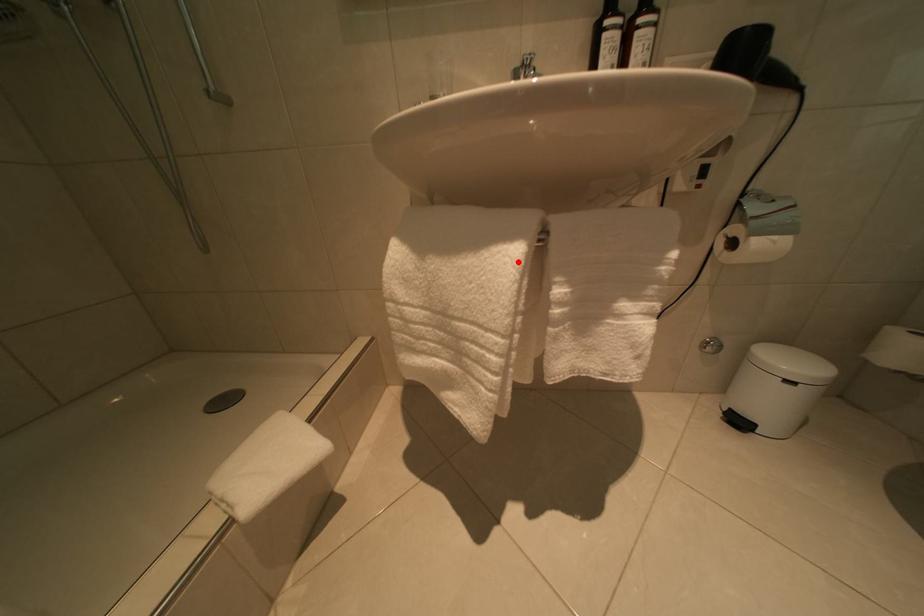
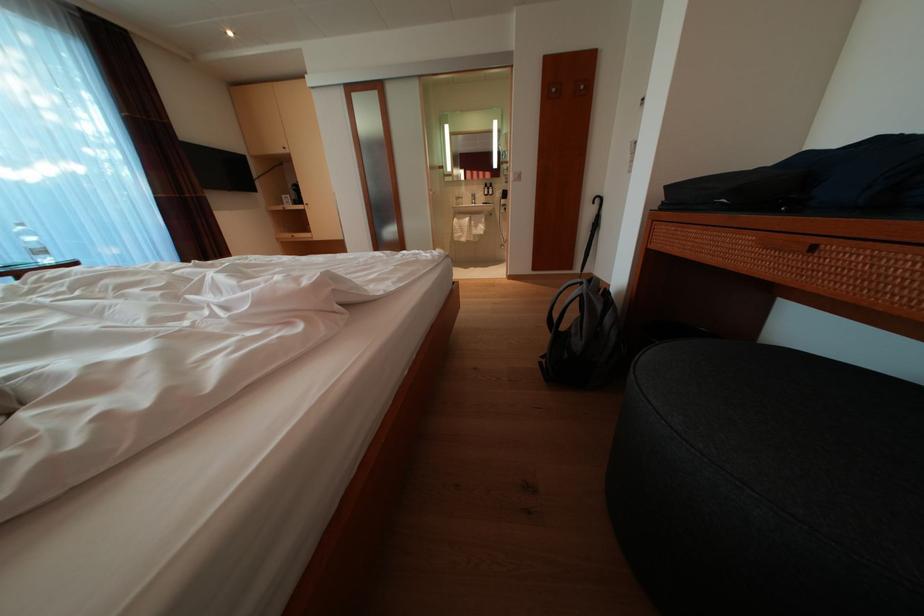
Question: I am providing you with two images of the same scene from different viewpoints. Image1 has a red point marked. In image2, the corresponding 3D location appears at what relative position? Reply with the corresponding letter.

Choices:
 (A) Closer
 (B) Farther

Answer: (A)